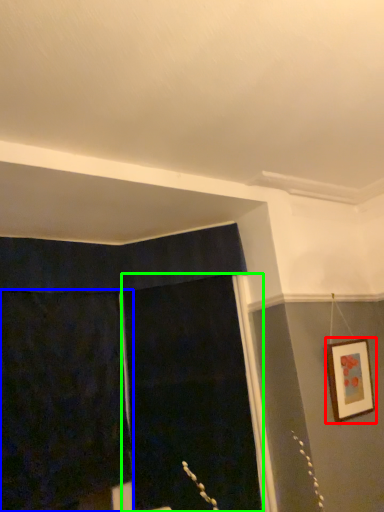
Question: Which object is positioned closest to picture frame (highlighted by a red box)? Select from curtain (highlighted by a blue box) and screen door (highlighted by a green box).

Choices:
 (A) curtain
 (B) screen door

Answer: (B)